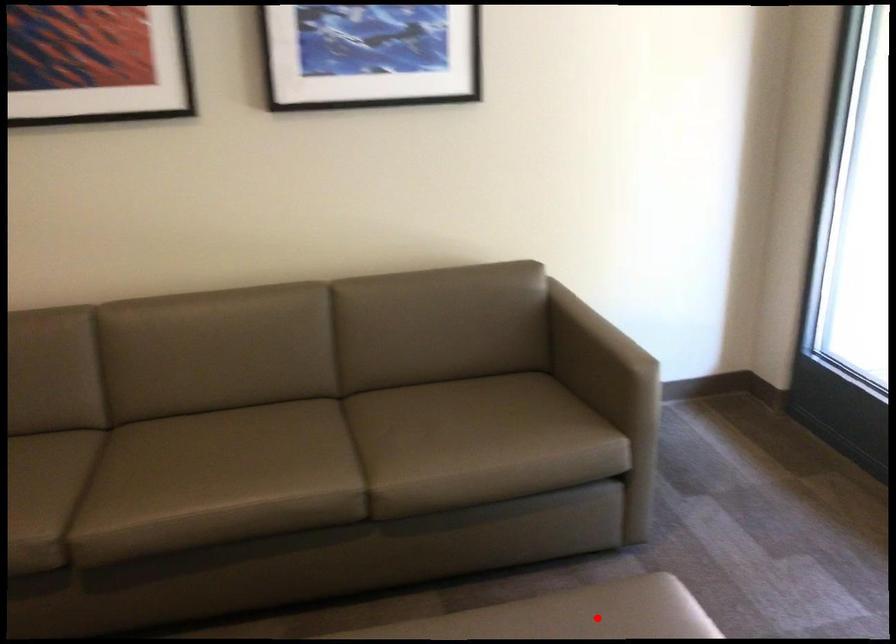
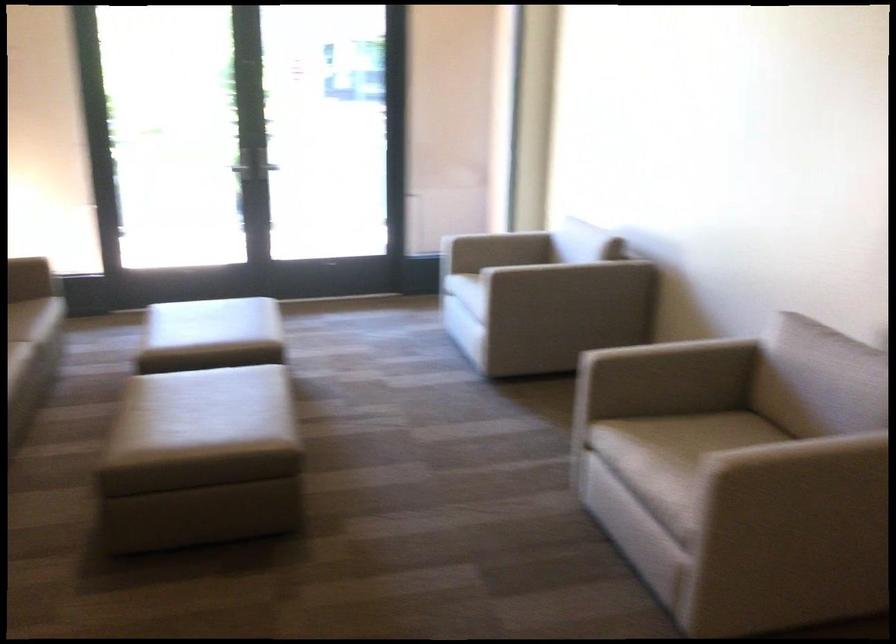
Question: I am providing you with two images of the same scene from different viewpoints. In image1, a red point is highlighted. Considering the same 3D point in image2, which of the following is correct?

Choices:
 (A) It is closer
 (B) It is farther

Answer: (B)